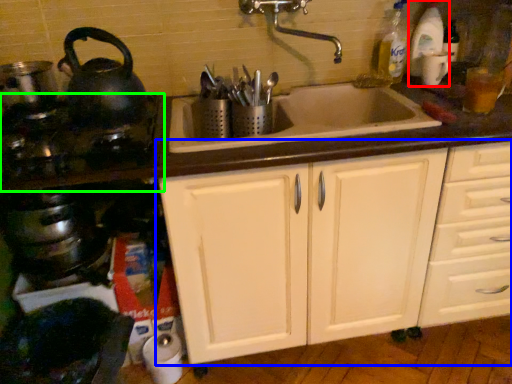
Question: Considering the real-world distances, which object is closest to bottle (highlighted by a red box)? cabinetry (highlighted by a blue box) or gas stove (highlighted by a green box).

Choices:
 (A) cabinetry
 (B) gas stove

Answer: (A)